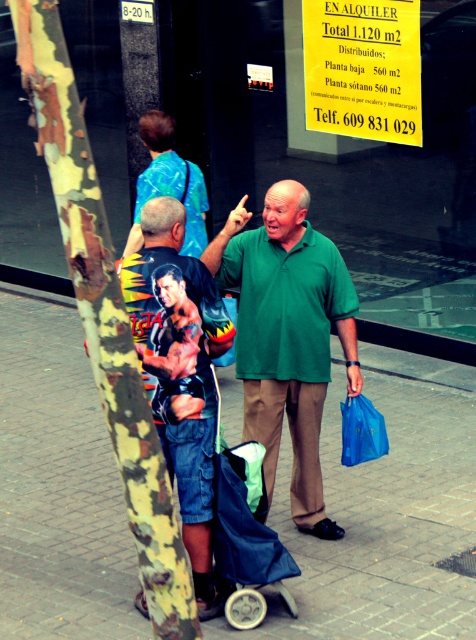
Does blue t-shirt at upper left have a smaller size compared to blue plastic bag at lower center?

Actually, blue t-shirt at upper left might be larger than blue plastic bag at lower center.

Which is in front, point (156, 138) or point (359, 451)?

Positioned in front is point (359, 451).

Image resolution: width=476 pixels, height=640 pixels. I want to click on blue t-shirt at upper left, so click(168, 182).

Between yellow paper sign at upper center and blue plastic bag at lower center, which one is positioned higher?

yellow paper sign at upper center is higher up.

From the picture: Is yellow paper sign at upper center taller than blue plastic bag at lower center?

Yes.

Between point (305, 68) and point (376, 410), which one is positioned behind?

The point (305, 68) is more distant.

Find the location of a particular element. This screenshot has height=640, width=476. yellow paper sign at upper center is located at coordinates (363, 68).

Is green matte shirt at center smaller than yellow paper sign at upper center?

Yes, green matte shirt at center is smaller than yellow paper sign at upper center.

Who is positioned more to the left, green matte shirt at center or yellow paper sign at upper center?

From the viewer's perspective, green matte shirt at center appears more on the left side.

Who is more distant from viewer, (315,480) or (403,60)?

Positioned behind is point (403,60).

The image size is (476, 640). Identify the location of green matte shirt at center. (287, 336).